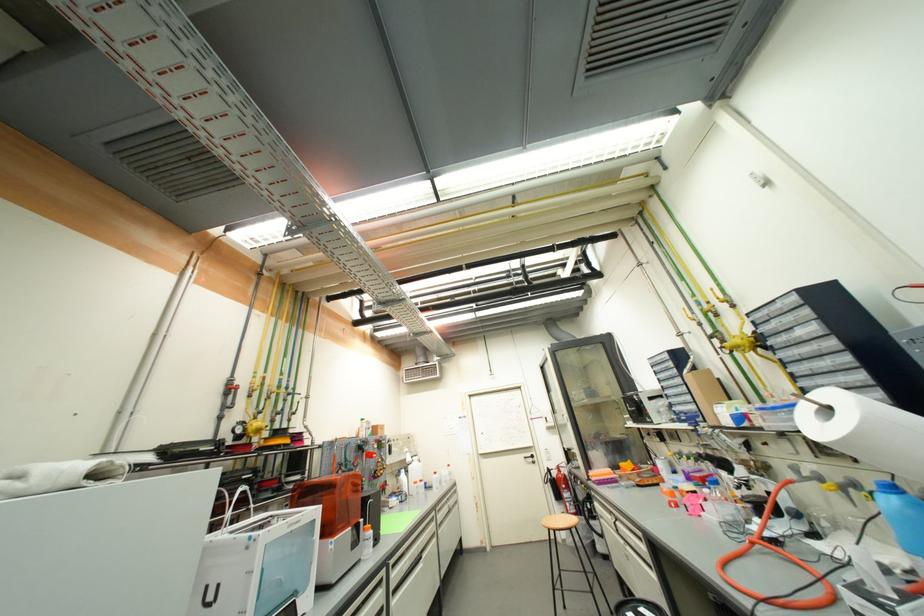
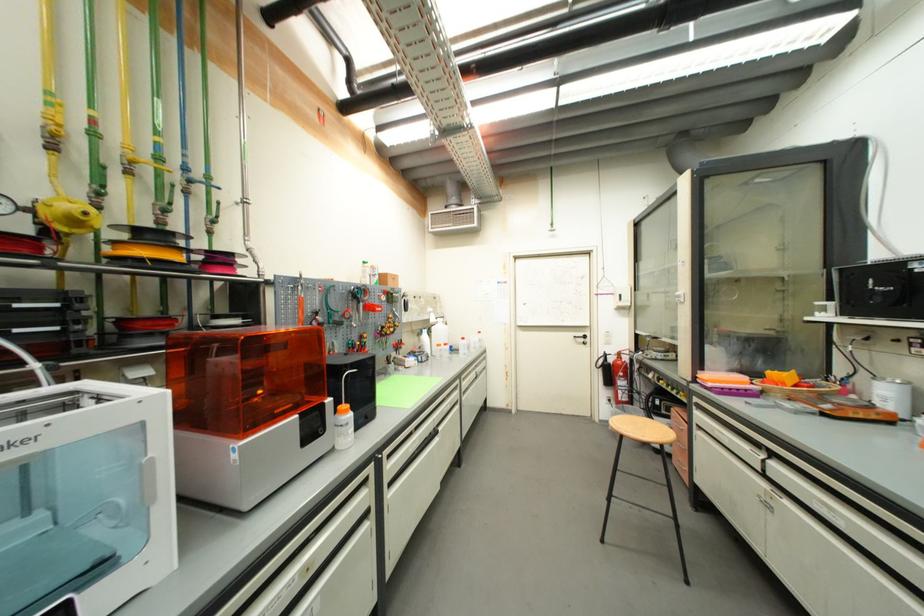
Where in the second image is the point corresponding to the point at 530,459 from the first image?

(580, 339)